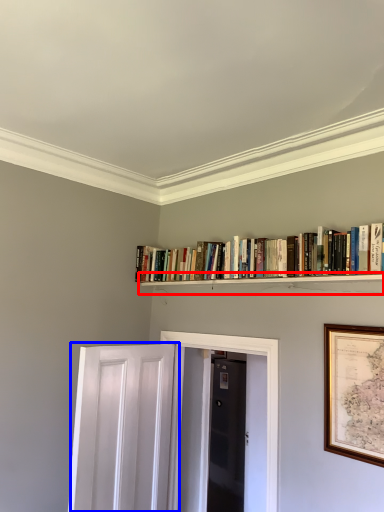
Question: Among these objects, which one is nearest to the camera, shelf (highlighted by a red box) or door (highlighted by a blue box)?

Choices:
 (A) shelf
 (B) door

Answer: (A)